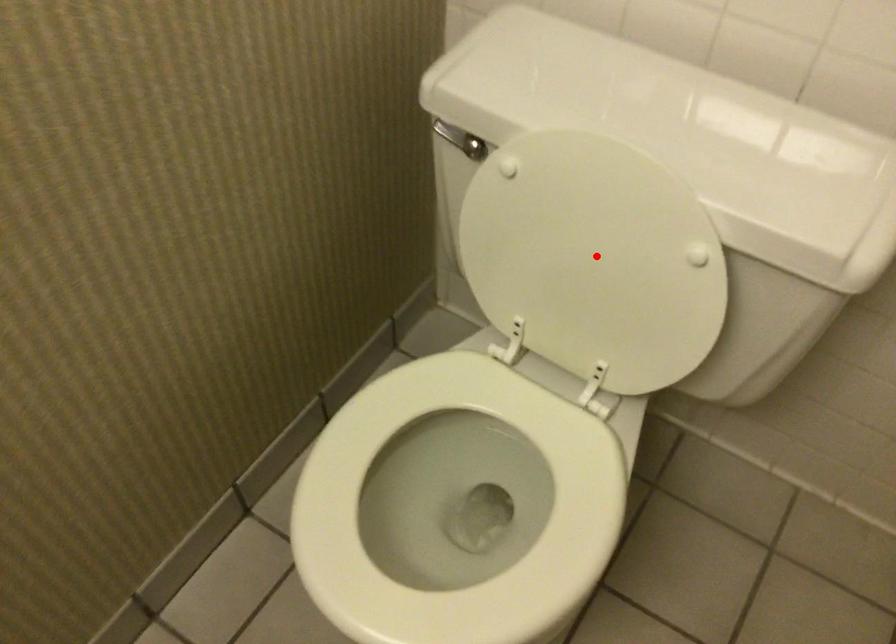
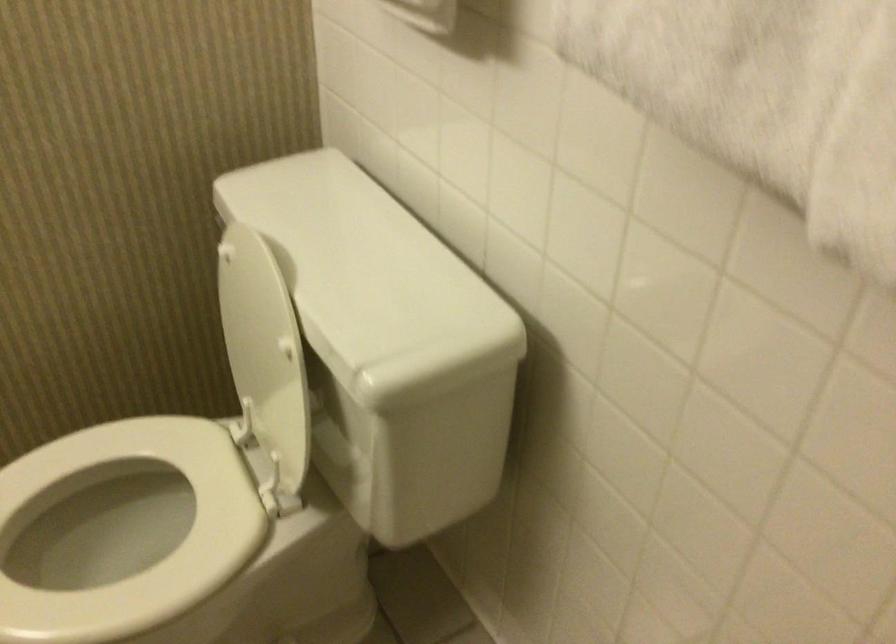
Where in the second image is the point corresponding to the highlighted location from the first image?

(259, 343)